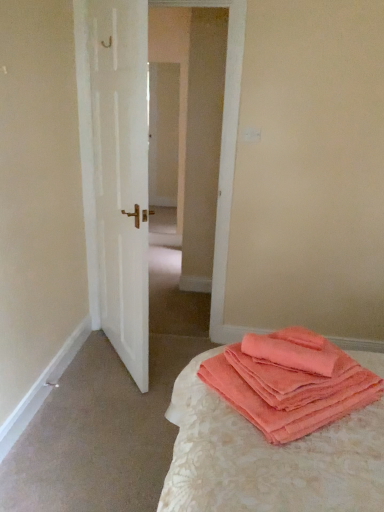
At what (x,y) coordinates should I click in order to perform the action: click on vacant space in front of white matte door at left. Please return your answer as a coordinate pair (x, y). The width and height of the screenshot is (384, 512). Looking at the image, I should click on (106, 419).